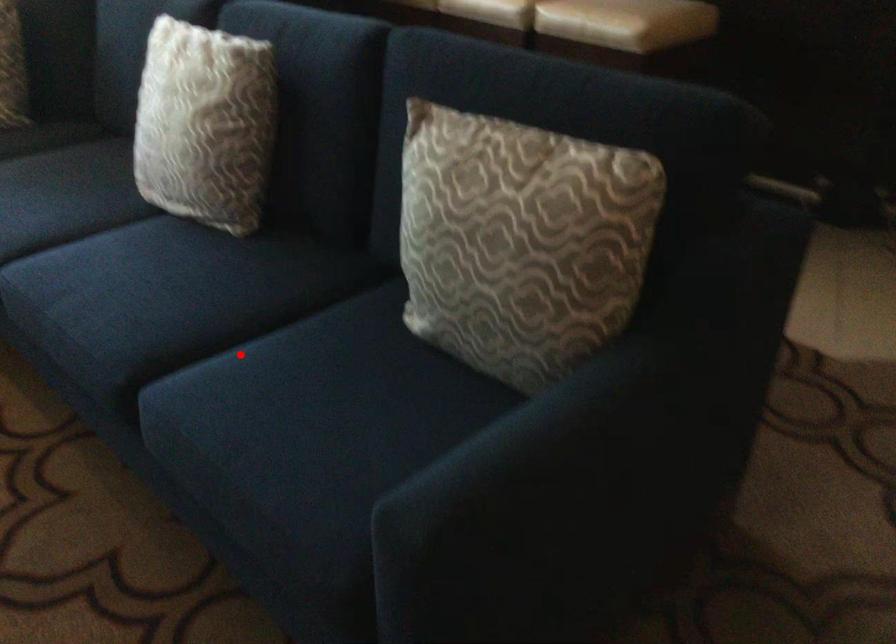
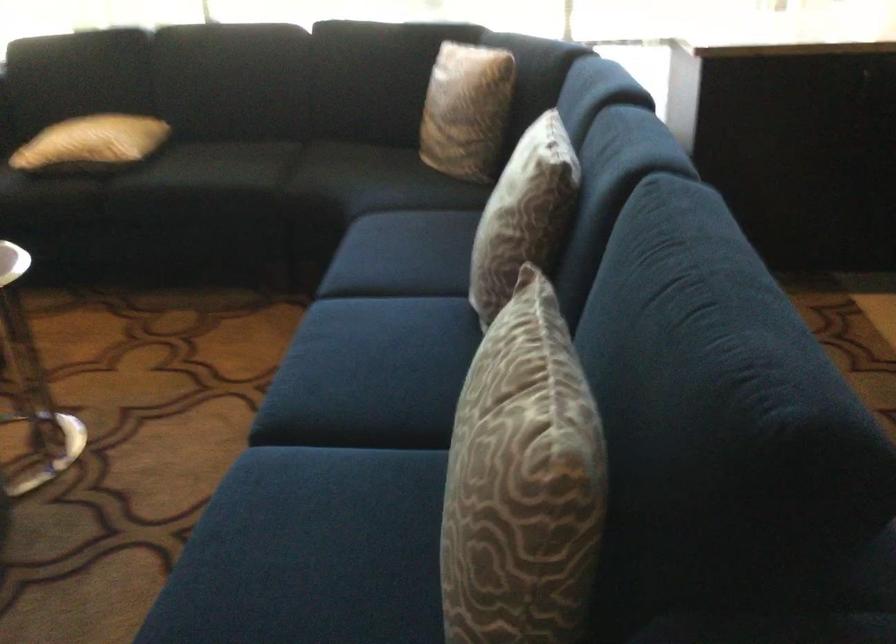
Find the pixel in the second image that matches the highlighted location in the first image.

(341, 458)